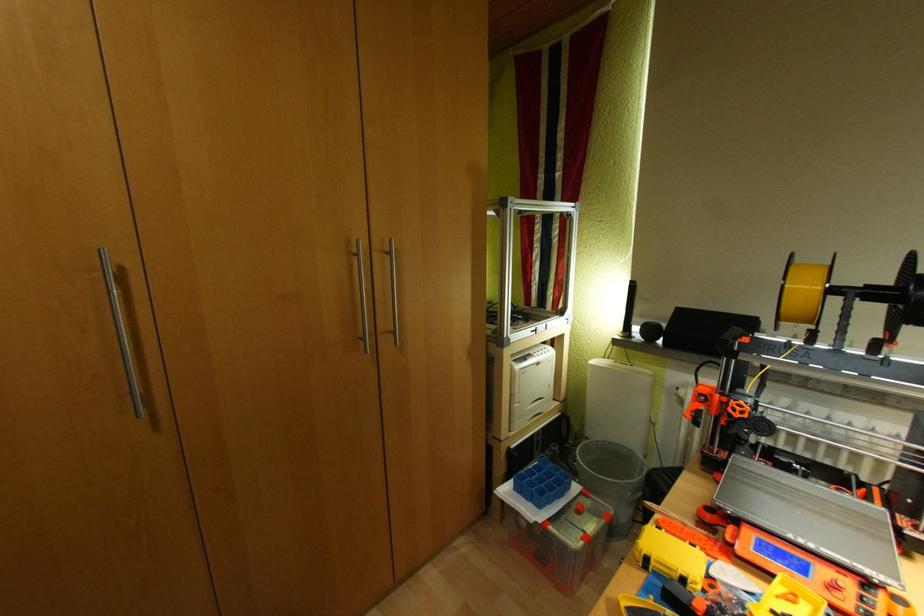
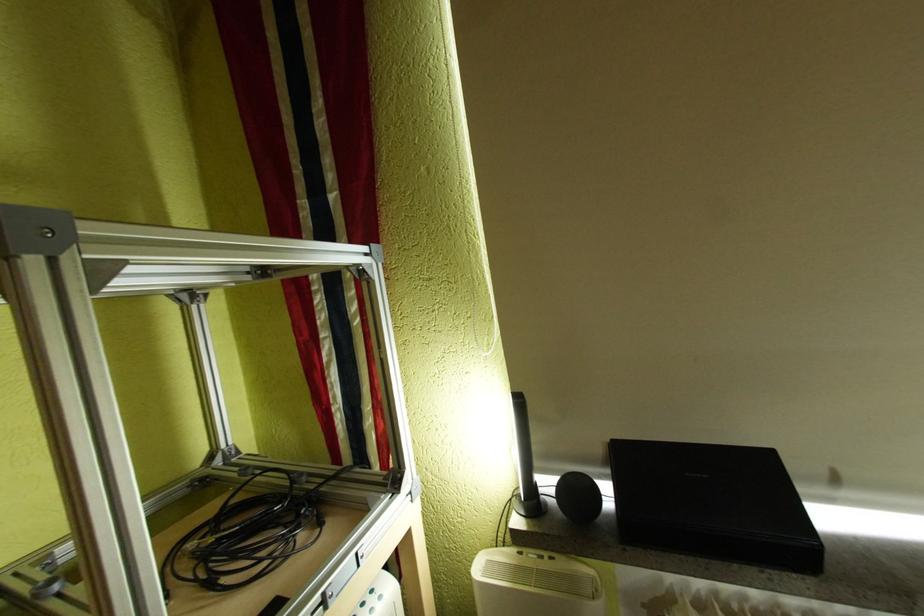
Based on the photo, what movement of the cameraman would produce the second image?

The cameraman walked toward right, forward.